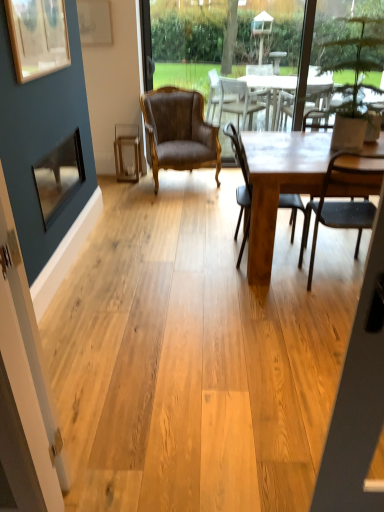
I want to click on vacant space that's between matte brown chair at center, the second chair in the back-to-front sequence, and transparent glass screen door at left, so click(x=192, y=334).